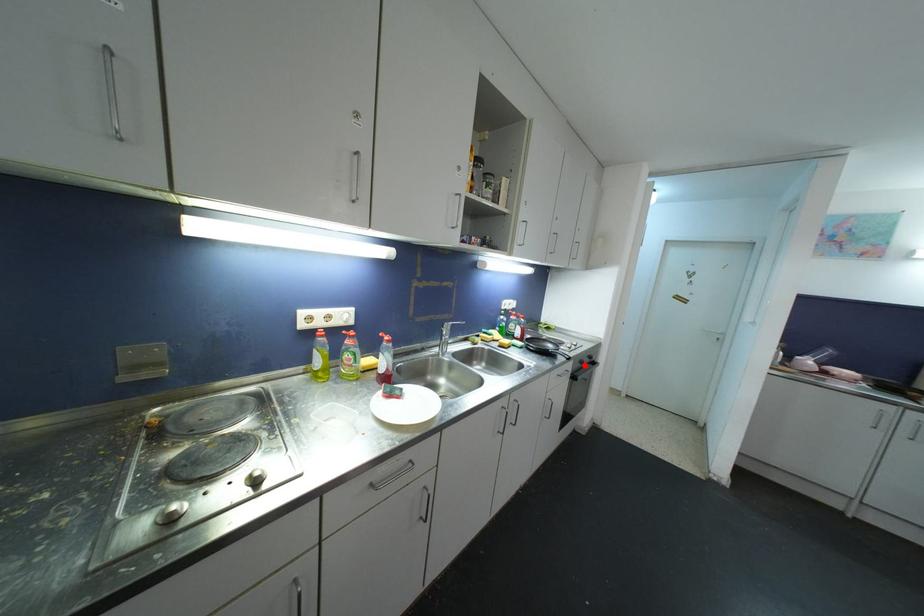
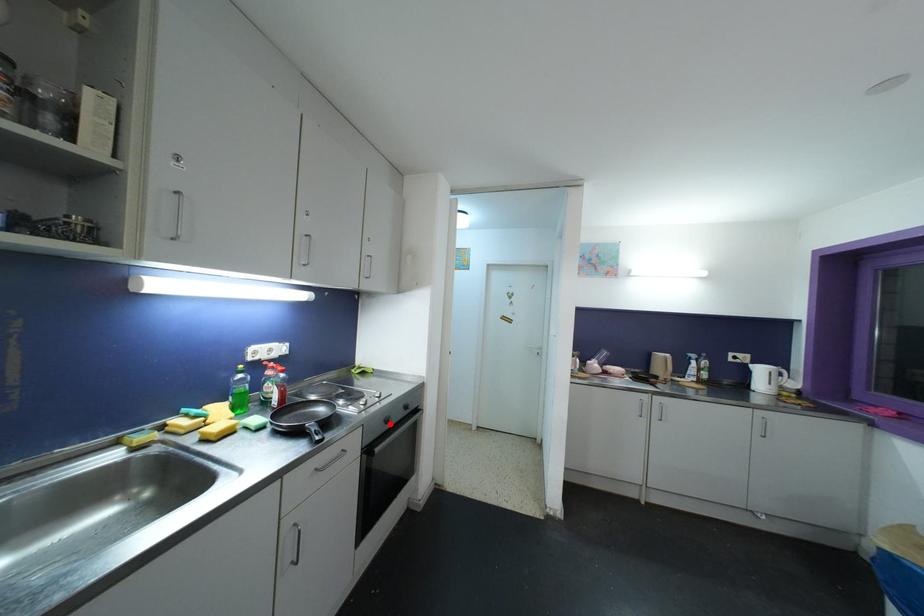
I am providing you with two images of the same scene from different viewpoints. A red point is marked on the first image and another point is marked on the second image. Is the marked point in image1 the same physical position as the marked point in image2?

Yes